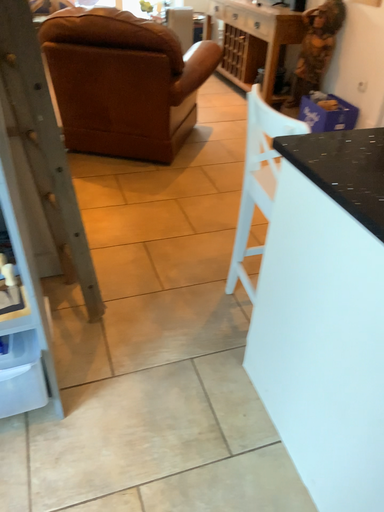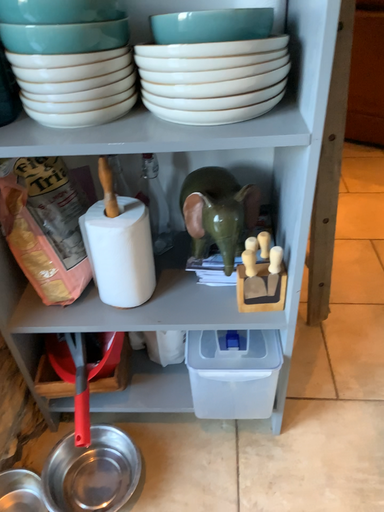
Question: Which way did the camera rotate in the video?

Choices:
 (A) rotated right
 (B) rotated left

Answer: (B)